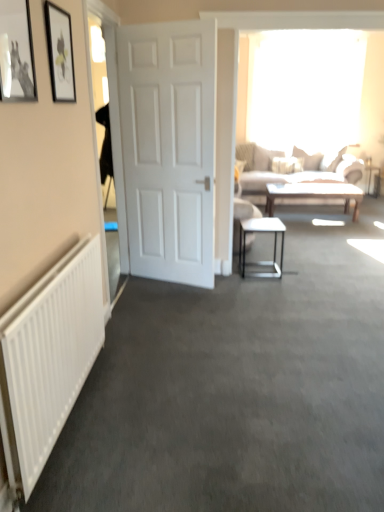
I want to click on metallic silver table at center, so click(x=274, y=245).

The image size is (384, 512). Identify the location of light beige fabric couch at upper right. (287, 173).

At what (x,y) coordinates should I click in order to perform the action: click on white matte radiator at left. Please return your answer as a coordinate pair (x, y). The width and height of the screenshot is (384, 512). Looking at the image, I should click on [x=48, y=358].

What is the approximate width of white matte door at center?

It is 7.10 inches.

Where is `transparent glass window at upper center`? The width and height of the screenshot is (384, 512). transparent glass window at upper center is located at coordinates (304, 87).

In the image, is transparent glass window at upper center positioned in front of or behind metallic silver picture frame at upper left, which is the 1th picture frame from front to back?

transparent glass window at upper center is positioned farther from the viewer than metallic silver picture frame at upper left, which is the 1th picture frame from front to back.

Would you say transparent glass window at upper center is to the left or to the right of metallic silver picture frame at upper left, the 2th picture frame positioned from the back, in the picture?

transparent glass window at upper center is to the right of metallic silver picture frame at upper left, the 2th picture frame positioned from the back.

Is transparent glass window at upper center looking in the opposite direction of metallic silver picture frame at upper left, the 2th picture frame positioned from the back?

transparent glass window at upper center does not have its back to metallic silver picture frame at upper left, the 2th picture frame positioned from the back.

Is transparent glass window at upper center taller than metallic silver picture frame at upper left, the 2th picture frame positioned from the back?

Indeed, transparent glass window at upper center has a greater height compared to metallic silver picture frame at upper left, the 2th picture frame positioned from the back.

Between white matte door at center and transparent glass window at upper center, which one appears on the left side from the viewer's perspective?

white matte door at center is more to the left.

Is transparent glass window at upper center at the back of white matte door at center?

Yes, white matte door at center is facing away from transparent glass window at upper center.

Between white matte door at center and transparent glass window at upper center, which one is positioned in front?

Positioned in front is white matte door at center.

From the image's perspective, is white matte radiator at left below transparent glass window at upper center?

Yes, from the image's perspective, white matte radiator at left is beneath transparent glass window at upper center.

Is there a large distance between white matte radiator at left and transparent glass window at upper center?

Indeed, white matte radiator at left is not near transparent glass window at upper center.

Considering the relative sizes of white matte radiator at left and transparent glass window at upper center in the image provided, is white matte radiator at left smaller than transparent glass window at upper center?

Correct, white matte radiator at left occupies less space than transparent glass window at upper center.

Between metallic silver table at center and transparent glass window at upper center, which one appears on the right side from the viewer's perspective?

transparent glass window at upper center.

From the image's perspective, does metallic silver table at center appear higher than transparent glass window at upper center?

No, from the image's perspective, metallic silver table at center is not on top of transparent glass window at upper center.

Is metallic silver table at center next to transparent glass window at upper center and touching it?

No, metallic silver table at center is not next to transparent glass window at upper center.

Is metallic silver table at center turned away from transparent glass window at upper center?

No, transparent glass window at upper center is not at the back of metallic silver table at center.

Who is taller, light brown wooden coffee table at center or metallic silver picture frame at upper left, which is the 1th picture frame from front to back?

metallic silver picture frame at upper left, which is the 1th picture frame from front to back.

Considering the relative positions of light brown wooden coffee table at center and metallic silver picture frame at upper left, the 2th picture frame positioned from the back, in the image provided, is light brown wooden coffee table at center to the right of metallic silver picture frame at upper left, the 2th picture frame positioned from the back, from the viewer's perspective?

Yes.

From the image's perspective, which one is positioned lower, light brown wooden coffee table at center or metallic silver picture frame at upper left, which is the 1th picture frame from front to back?

From the image's view, light brown wooden coffee table at center is below.

Can you confirm if metallic silver table at center is positioned to the right of light beige fabric couch at upper right?

No, metallic silver table at center is not to the right of light beige fabric couch at upper right.

What are the coordinates of `studio couch located above the metallic silver table at center (from a real-world perspective)` in the screenshot? It's located at (287, 173).

Can you tell me how much metallic silver table at center and light beige fabric couch at upper right differ in facing direction?

93.9 degrees separate the facing orientations of metallic silver table at center and light beige fabric couch at upper right.

Is metallic silver table at center surrounding light beige fabric couch at upper right?

Definitely not — light beige fabric couch at upper right is not inside metallic silver table at center.

Is light beige fabric couch at upper right thinner than transparent glass window at upper center?

No, light beige fabric couch at upper right is not thinner than transparent glass window at upper center.

Is light beige fabric couch at upper right positioned with its back to transparent glass window at upper center?

No, light beige fabric couch at upper right's orientation is not away from transparent glass window at upper center.

From the image's perspective, between light beige fabric couch at upper right and transparent glass window at upper center, which one is located above?

transparent glass window at upper center.

Relative to transparent glass window at upper center, is light beige fabric couch at upper right in front or behind?

light beige fabric couch at upper right is positioned closer to the viewer than transparent glass window at upper center.

From a real-world perspective, count 1st picture frames upward from the transparent glass window at upper center and point to it. Please provide its 2D coordinates.

[(16, 53)]

At what (x,y) coordinates should I click in order to perform the action: click on window located behind the white matte door at center. Please return your answer as a coordinate pair (x, y). The width and height of the screenshot is (384, 512). Looking at the image, I should click on (304, 87).

When comparing their distances from white matte radiator at left, does white matte door at center or metallic silver picture frame at upper left, which is the 1th picture frame from front to back, seem closer?

metallic silver picture frame at upper left, which is the 1th picture frame from front to back, is closer to white matte radiator at left.

Considering their positions, is transparent glass window at upper center positioned closer to white glossy door at left than metallic silver table at center?

metallic silver table at center is closer to white glossy door at left.

When comparing their distances from white glossy door at left, does transparent glass window at upper center or light brown wooden coffee table at center seem closer?

light brown wooden coffee table at center is closer to white glossy door at left.

Based on their spatial positions, is white glossy door at left or light beige fabric couch at upper right closer to light brown wooden coffee table at center?

light beige fabric couch at upper right is closer to light brown wooden coffee table at center.

When comparing their distances from light beige fabric couch at upper right, does white matte radiator at left or metallic silver table at center seem closer?

Among the two, metallic silver table at center is located nearer to light beige fabric couch at upper right.

Looking at the image, which one is located closer to light beige fabric couch at upper right, white matte door at center or transparent glass window at upper center?

Among the two, transparent glass window at upper center is located nearer to light beige fabric couch at upper right.

When comparing their distances from white glossy door at left, does white matte door at center or light brown wooden coffee table at center seem closer?

Based on the image, white matte door at center appears to be nearer to white glossy door at left.

When comparing their distances from matte black picture frame at upper left, the 2th picture frame when ordered from front to back, does light brown wooden coffee table at center or white glossy door at left seem closer?

white glossy door at left.

Where is `table located between metallic silver picture frame at upper left, which is the 1th picture frame from front to back, and transparent glass window at upper center in the depth direction`? The image size is (384, 512). table located between metallic silver picture frame at upper left, which is the 1th picture frame from front to back, and transparent glass window at upper center in the depth direction is located at coordinates (274, 245).

Find the location of a particular element. The height and width of the screenshot is (512, 384). glass door between metallic silver picture frame at upper left, the 2th picture frame positioned from the back, and light brown wooden coffee table at center from front to back is located at coordinates (116, 140).

The image size is (384, 512). In order to click on studio couch between white matte radiator at left and transparent glass window at upper center along the z-axis in this screenshot , I will do `click(287, 173)`.

Find the location of `glass door between metallic silver picture frame at upper left, which is the 1th picture frame from front to back, and white matte radiator at left from top to bottom`. glass door between metallic silver picture frame at upper left, which is the 1th picture frame from front to back, and white matte radiator at left from top to bottom is located at coordinates (116, 140).